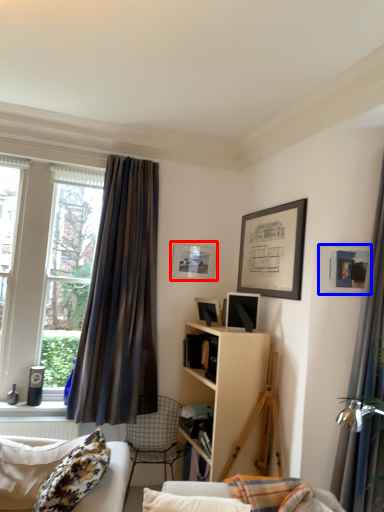
Question: Which point is further to the camera, picture frame (highlighted by a red box) or picture frame (highlighted by a blue box)?

Choices:
 (A) picture frame
 (B) picture frame

Answer: (A)